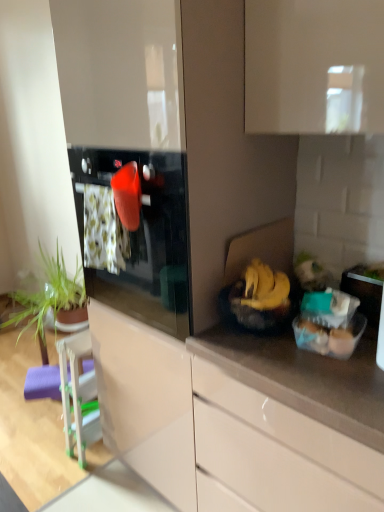
Where is `free area below white glossy chair at lower left, which appears as the second appliance when viewed from the top (from a real-world perspective)`? This screenshot has height=512, width=384. free area below white glossy chair at lower left, which appears as the second appliance when viewed from the top (from a real-world perspective) is located at coordinates tap(91, 454).